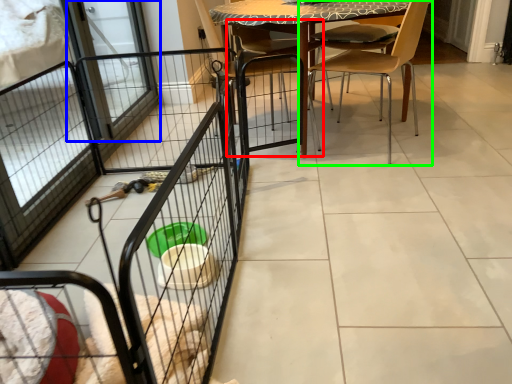
Question: Which is nearer to the armchair (highlighted by a red box)? screen door (highlighted by a blue box) or chair (highlighted by a green box).

Choices:
 (A) screen door
 (B) chair

Answer: (B)